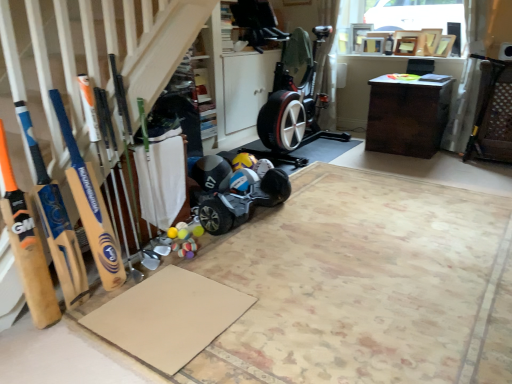
Question: Considering the relative positions of beige cardboard at lower left, marked as the 2th yoga mat in a back-to-front arrangement, and black rubber baby carriage at center in the image provided, is beige cardboard at lower left, marked as the 2th yoga mat in a back-to-front arrangement, to the left or to the right of black rubber baby carriage at center?

Choices:
 (A) left
 (B) right

Answer: (B)

Question: From a real-world perspective, relative to black rubber baby carriage at center, is beige cardboard at lower left, marked as the 2th yoga mat in a back-to-front arrangement, vertically above or below?

Choices:
 (A) below
 (B) above

Answer: (A)

Question: Which object is positioned closest to the wooden bat at left, arranged as the 1th baseball bat when viewed from the left?

Choices:
 (A) beige cardboard at lower left, the 1th yoga mat positioned from the front
 (B) brown cardboard yoga mat at lower left, acting as the second yoga mat starting from the front
 (C) black rubber baby carriage at center
 (D) wooden bat at left, which is counted as the second baseball bat, starting from the left
 (E) dark brown wooden desk at center

Answer: (D)

Question: Considering the real-world distances, which object is farthest from the wooden bat at left, which is the second baseball bat from right to left?

Choices:
 (A) wooden bat at left, placed as the first baseball bat when sorted from right to left
 (B) beige cardboard at lower left, marked as the 2th yoga mat in a back-to-front arrangement
 (C) matte black helmet at center
 (D) dark brown wooden desk at center
 (E) brown cardboard yoga mat at lower left, acting as the second yoga mat starting from the front

Answer: (D)